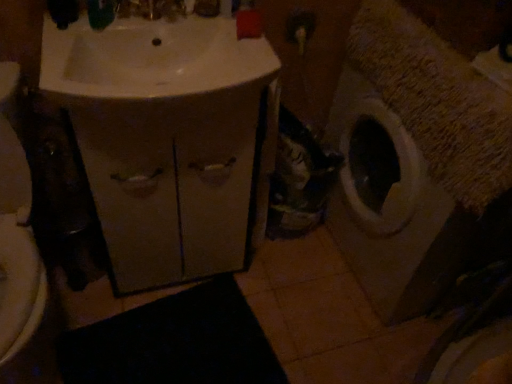
Describe the element at coordinates (174, 184) in the screenshot. I see `matte beige cabinet at center` at that location.

I want to click on black rubber bath mat at lower center, so click(x=174, y=342).

Where is `white glossy sink at upper left`? This screenshot has height=384, width=512. white glossy sink at upper left is located at coordinates (150, 58).

Does textured beige washing machine at right have a larger size compared to matte beige cabinet at center?

Yes, textured beige washing machine at right is bigger than matte beige cabinet at center.

From their relative heights in the image, would you say textured beige washing machine at right is taller or shorter than matte beige cabinet at center?

textured beige washing machine at right is taller than matte beige cabinet at center.

Where is `drawer below the textured beige washing machine at right (from the image's perspective)`? The height and width of the screenshot is (384, 512). drawer below the textured beige washing machine at right (from the image's perspective) is located at coordinates (174, 184).

From the image's perspective, does textured beige washing machine at right appear higher than matte beige cabinet at center?

Yes, from the image's perspective, textured beige washing machine at right is over matte beige cabinet at center.

Locate an element on the screen. washing machine on the right side of white glossy sink at upper left is located at coordinates point(389,207).

In the image, is white glossy sink at upper left positioned in front of or behind textured beige washing machine at right?

In the image, white glossy sink at upper left appears in front of textured beige washing machine at right.

From a real-world perspective, is white glossy sink at upper left positioned over textured beige washing machine at right based on gravity?

Yes, from a real-world perspective, white glossy sink at upper left is over textured beige washing machine at right

Considering the relative sizes of white glossy sink at upper left and textured beige washing machine at right in the image provided, is white glossy sink at upper left shorter than textured beige washing machine at right?

Correct, white glossy sink at upper left is not as tall as textured beige washing machine at right.

Consider the image. How many degrees apart are the facing directions of black rubber bath mat at lower center and matte beige cabinet at center?

The facing directions of black rubber bath mat at lower center and matte beige cabinet at center are 16 degrees apart.

You are a GUI agent. You are given a task and a screenshot of the screen. Output one action in this format:
    pyautogui.click(x=<x>, y=<y>)
    Task: Click on the drawer in front of the black rubber bath mat at lower center
    The height and width of the screenshot is (384, 512).
    Given the screenshot: What is the action you would take?
    pyautogui.click(x=174, y=184)

Is point (251, 338) farther from camera compared to point (147, 244)?

Yes.

Would you consider black rubber bath mat at lower center to be distant from matte beige cabinet at center?

No, black rubber bath mat at lower center is not far away from matte beige cabinet at center.

Considering the relative positions of white glossy sink at upper left and black rubber bath mat at lower center in the image provided, is white glossy sink at upper left to the left of black rubber bath mat at lower center from the viewer's perspective?

No.

Is white glossy sink at upper left far from black rubber bath mat at lower center?

Actually, white glossy sink at upper left and black rubber bath mat at lower center are a little close together.

Is white glossy sink at upper left outside of black rubber bath mat at lower center?

white glossy sink at upper left lies outside black rubber bath mat at lower center's area.

Which is farther from the camera, (362, 193) or (130, 349)?

The point (362, 193) is more distant.

Locate an element on the screen. Image resolution: width=512 pixels, height=384 pixels. washing machine located in front of the black rubber bath mat at lower center is located at coordinates (389, 207).

Between textured beige washing machine at right and black rubber bath mat at lower center, which one has larger width?

Wider between the two is textured beige washing machine at right.

From the image's perspective, relative to black rubber bath mat at lower center, is textured beige washing machine at right above or below?

Based on their image positions, textured beige washing machine at right is located above black rubber bath mat at lower center.

Is textured beige washing machine at right far from white glossy sink at upper left?

No.

Does textured beige washing machine at right turn towards white glossy sink at upper left?

Yes, textured beige washing machine at right is facing white glossy sink at upper left.

Considering the sizes of objects textured beige washing machine at right and white glossy sink at upper left in the image provided, who is taller, textured beige washing machine at right or white glossy sink at upper left?

Standing taller between the two is textured beige washing machine at right.

In the image, there is a black rubber bath mat at lower center. In order to click on drawer above it (from the image's perspective) in this screenshot , I will do click(x=174, y=184).

Considering the sizes of objects matte beige cabinet at center and black rubber bath mat at lower center in the image provided, who is smaller, matte beige cabinet at center or black rubber bath mat at lower center?

With smaller size is black rubber bath mat at lower center.

Find the location of a particular element. drawer to the left of textured beige washing machine at right is located at coordinates (174, 184).

Locate an element on the screen. washing machine behind the white glossy sink at upper left is located at coordinates point(389,207).

Estimate the real-world distances between objects in this image. Which object is closer to black rubber bath mat at lower center, matte beige cabinet at center or textured beige washing machine at right?

matte beige cabinet at center.

Based on their spatial positions, is black rubber bath mat at lower center or textured beige washing machine at right further from white glossy sink at upper left?

black rubber bath mat at lower center is positioned further to the anchor white glossy sink at upper left.

Estimate the real-world distances between objects in this image. Which object is closer to black rubber bath mat at lower center, textured beige washing machine at right or white glossy sink at upper left?

Among the two, textured beige washing machine at right is located nearer to black rubber bath mat at lower center.

Which object lies nearer to the anchor point matte beige cabinet at center, white glossy sink at upper left or black rubber bath mat at lower center?

white glossy sink at upper left is closer to matte beige cabinet at center.

Which object lies further to the anchor point white glossy sink at upper left, black rubber bath mat at lower center or matte beige cabinet at center?

black rubber bath mat at lower center is further to white glossy sink at upper left.

From the image, which object appears to be nearer to textured beige washing machine at right, black rubber bath mat at lower center or matte beige cabinet at center?

Among the two, matte beige cabinet at center is located nearer to textured beige washing machine at right.

Looking at this image, looking at the image, which one is located closer to black rubber bath mat at lower center, white glossy sink at upper left or matte beige cabinet at center?

matte beige cabinet at center is closer to black rubber bath mat at lower center.

Which object lies further to the anchor point textured beige washing machine at right, matte beige cabinet at center or white glossy sink at upper left?

Among the two, white glossy sink at upper left is located further to textured beige washing machine at right.

At what (x,y) coordinates should I click in order to perform the action: click on drawer situated between black rubber bath mat at lower center and textured beige washing machine at right from left to right. Please return your answer as a coordinate pair (x, y). The width and height of the screenshot is (512, 384). Looking at the image, I should click on (174, 184).

Locate an element on the screen. This screenshot has height=384, width=512. sink situated between matte beige cabinet at center and textured beige washing machine at right from left to right is located at coordinates (150, 58).

This screenshot has width=512, height=384. I want to click on sink between black rubber bath mat at lower center and textured beige washing machine at right, so click(150, 58).

Where is `drawer between white glossy sink at upper left and black rubber bath mat at lower center in the vertical direction`? This screenshot has height=384, width=512. drawer between white glossy sink at upper left and black rubber bath mat at lower center in the vertical direction is located at coordinates (174, 184).